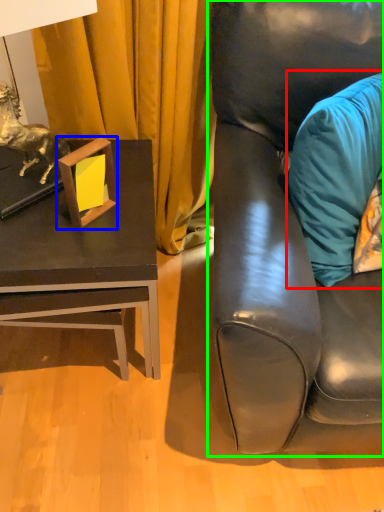
Question: Based on their relative distances, which object is nearer to pillow (highlighted by a red box)? Choose from picture frame (highlighted by a blue box) and studio couch (highlighted by a green box).

Choices:
 (A) picture frame
 (B) studio couch

Answer: (B)